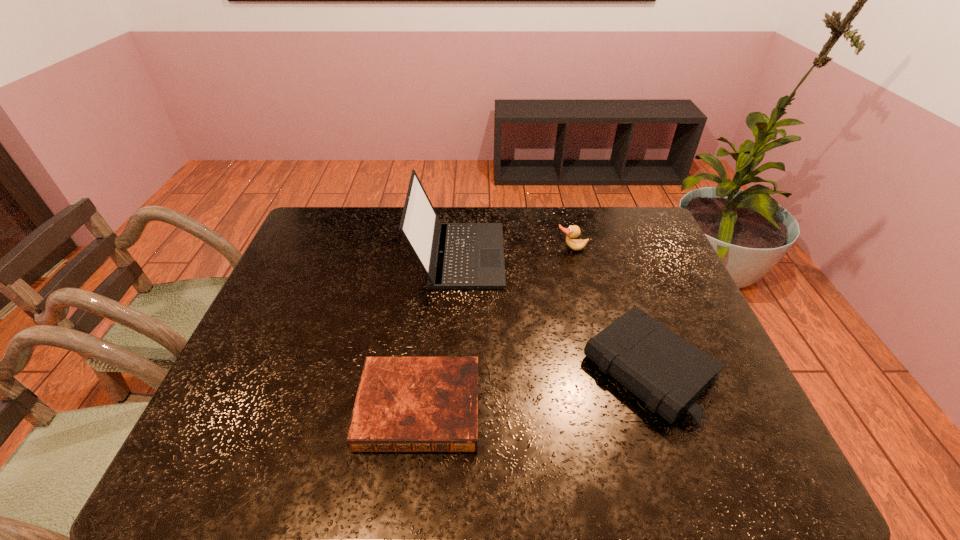
Locate an element on the screen. This screenshot has width=960, height=540. object that stands as the second closest to the tallest object is located at coordinates (666, 372).

Identify the location of object that is the third nearest to the duck. (403, 404).

Where is `free space that satisfies the following two spatial constraints: 1. on the surface of the tallest object; 2. on the spine side of the left Bible`? Image resolution: width=960 pixels, height=540 pixels. free space that satisfies the following two spatial constraints: 1. on the surface of the tallest object; 2. on the spine side of the left Bible is located at coordinates (450, 407).

Where is `vacant position in the image that satisfies the following two spatial constraints: 1. on the beak of the duck; 2. on the surface of the tallest object`? vacant position in the image that satisfies the following two spatial constraints: 1. on the beak of the duck; 2. on the surface of the tallest object is located at coordinates (573, 255).

Where is `vacant space that satisfies the following two spatial constraints: 1. on the surface of the right Bible; 2. on the right side of the laptop`? Image resolution: width=960 pixels, height=540 pixels. vacant space that satisfies the following two spatial constraints: 1. on the surface of the right Bible; 2. on the right side of the laptop is located at coordinates (452, 370).

Identify the location of free space that satisfies the following two spatial constraints: 1. on the beak of the duck; 2. on the surface of the laptop. The width and height of the screenshot is (960, 540). (573, 255).

You are a GUI agent. You are given a task and a screenshot of the screen. Output one action in this format:
    pyautogui.click(x=<x>, y=<y>)
    Task: Click on the vacant space that satisfies the following two spatial constraints: 1. on the beak of the third shortest object; 2. on the surface of the laptop
    
    Given the screenshot: What is the action you would take?
    pyautogui.click(x=573, y=255)

The width and height of the screenshot is (960, 540). What are the coordinates of `free location that satisfies the following two spatial constraints: 1. on the surface of the right Bible; 2. on the left side of the tallest object` in the screenshot? It's located at (452, 370).

The image size is (960, 540). What are the coordinates of `free space that satisfies the following two spatial constraints: 1. on the surface of the laptop; 2. on the spine side of the shorter Bible` in the screenshot? It's located at (450, 407).

I want to click on vacant region that satisfies the following two spatial constraints: 1. on the surface of the laptop; 2. on the spine side of the shortest object, so click(x=450, y=407).